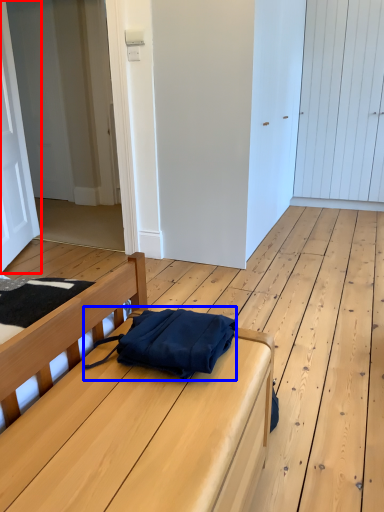
Question: Which of the following is the closest to the observer, door (highlighted by a red box) or messenger bag (highlighted by a blue box)?

Choices:
 (A) door
 (B) messenger bag

Answer: (B)